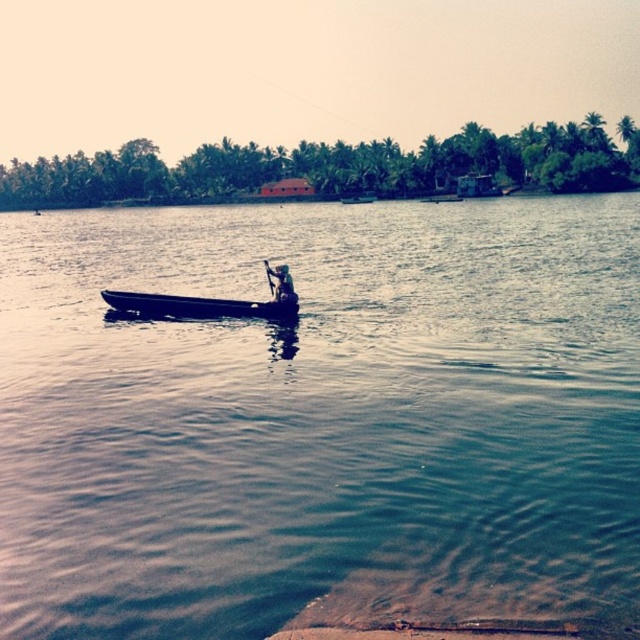
You are standing on the riverside and see the clear blue water at center and the dark blue fabric boat at center. Which object is bigger in size?

The clear blue water at center is larger in size compared to the dark blue fabric boat at center.

You are standing on the riverside and want to place both the clear blue water at center and the wooden paddle at center onto a shelf. Which one has a greater width?

The clear blue water at center is wider than the wooden paddle at center, so the clear blue water at center has a greater width.